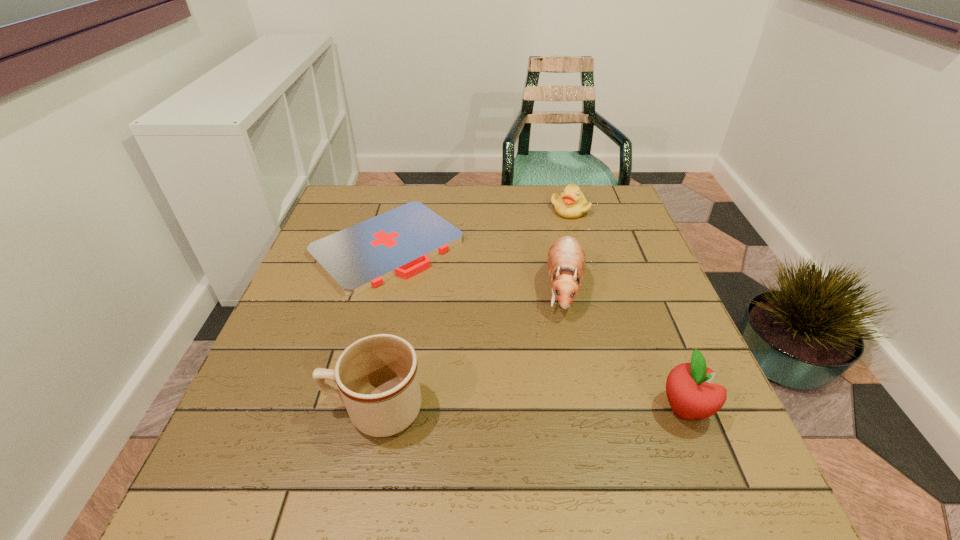
Identify which object is the second closest to the fourth tallest object. Please provide its 2D coordinates. Your answer should be formatted as a tuple, i.e. [(x, y)], where the tuple contains the x and y coordinates of a point satisfying the conditions above.

[(400, 242)]

Select which object appears as the closest to the mug. Please provide its 2D coordinates. Your answer should be formatted as a tuple, i.e. [(x, y)], where the tuple contains the x and y coordinates of a point satisfying the conditions above.

[(400, 242)]

The width and height of the screenshot is (960, 540). I want to click on vacant space that satisfies the following two spatial constraints: 1. on the front side of the hamster; 2. on the side where a bite is taken out of the rightmost object, so click(589, 409).

The image size is (960, 540). In order to click on vacant point that satisfies the following two spatial constraints: 1. on the front side of the mug; 2. on the side of the shortest object with the handle in this screenshot , I will do `click(345, 409)`.

This screenshot has width=960, height=540. I want to click on blank space that satisfies the following two spatial constraints: 1. on the back side of the fourth tallest object; 2. on the left side of the hamster, so click(x=547, y=210).